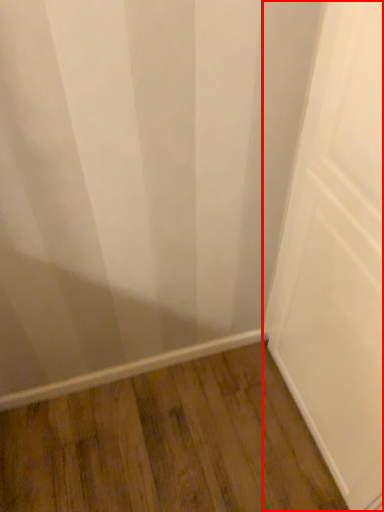
Question: From the image's perspective, considering the relative positions of door (annotated by the red box) and hardwood in the image provided, where is door (annotated by the red box) located with respect to the staircase?

Choices:
 (A) above
 (B) below

Answer: (A)